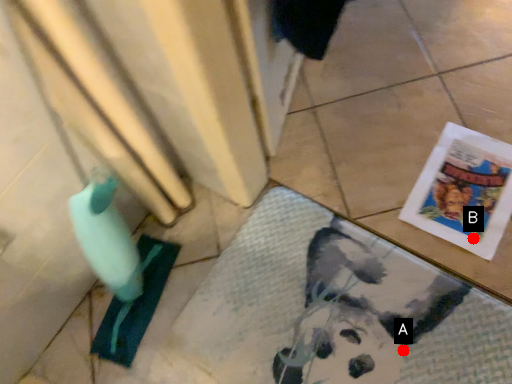
Question: Two points are circled on the image, labeled by A and B beside each circle. Which point is closer to the camera?

Choices:
 (A) A is closer
 (B) B is closer

Answer: (A)